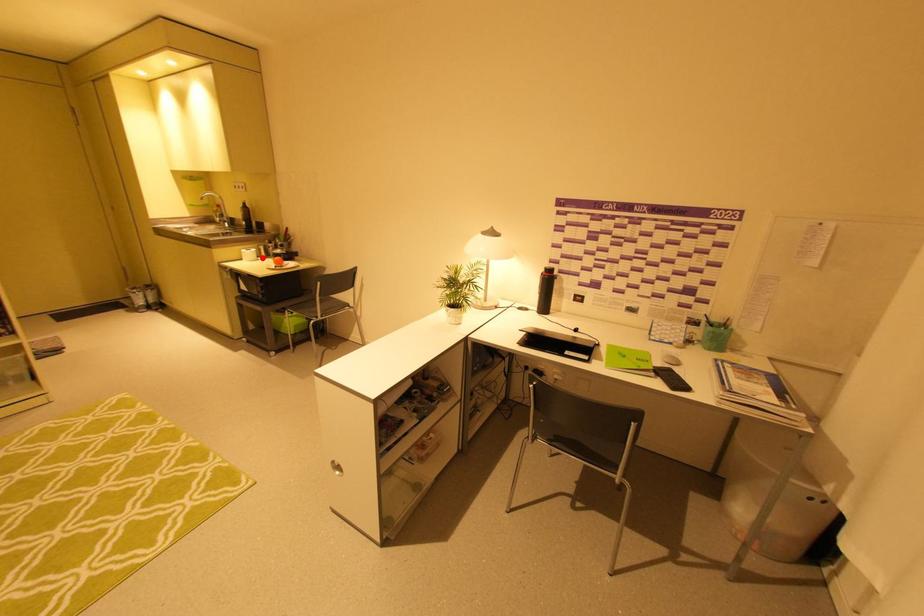
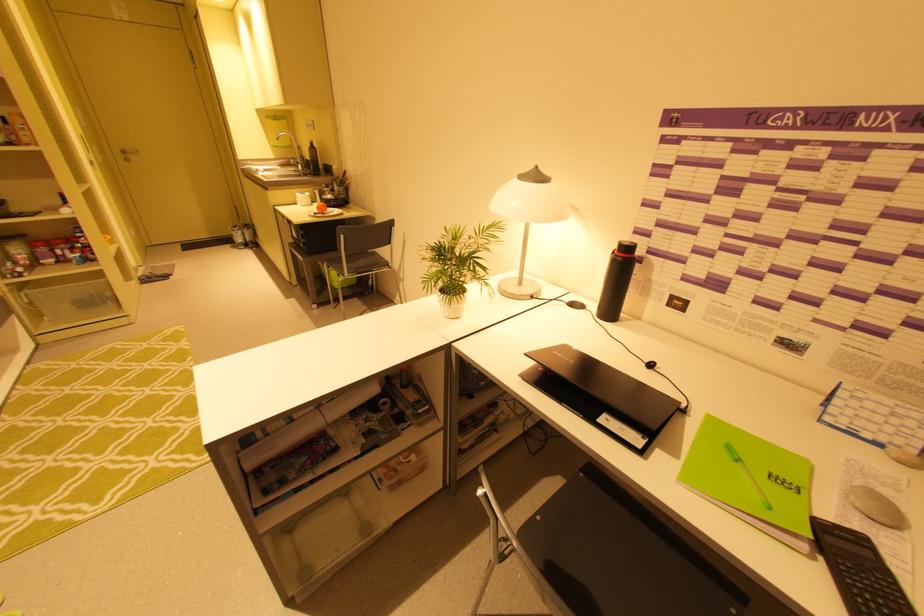
In the second image, find the point that corresponds to the highlighted location in the first image.

(317, 203)